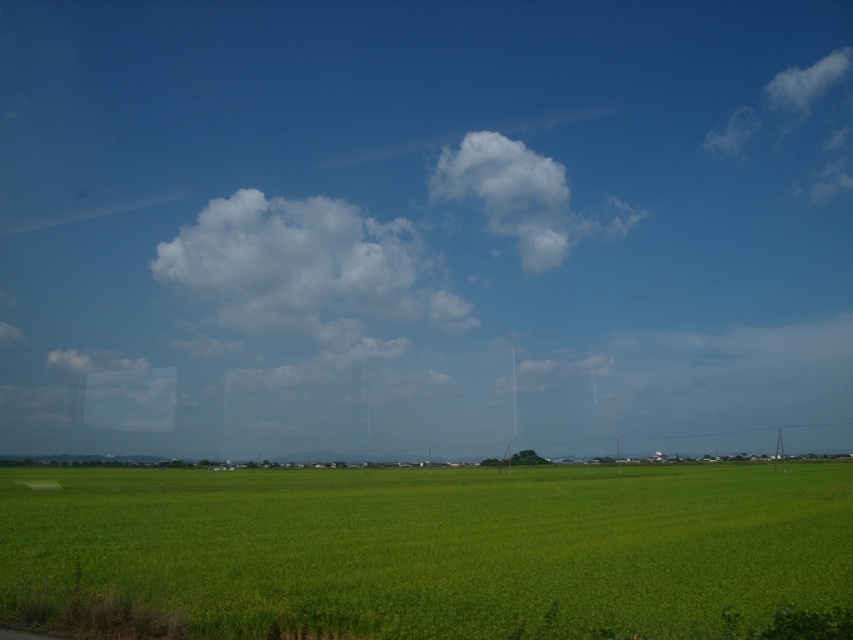
You are standing in the middle of the rice paddy field and see two points in the scene. The first point is at coordinates point (x=426, y=513) and the second is at point (x=503, y=152). Which point is closer to you?

Point (x=426, y=513) is in front of point (x=503, y=152), so the first point is closer to you.

You are a bird flying over the rural landscape. You see the green grass at lower center and the white fluffy cloud at upper center. Which object is closer to the ground?

The green grass at lower center is closer to the ground because it is located below the white fluffy cloud at upper center.

You are a farmer standing in the middle of the green grass at lower center. You look up and see the white fluffy cloud at upper center. Which object is taller?

The white fluffy cloud at upper center is taller than the green grass at lower center.